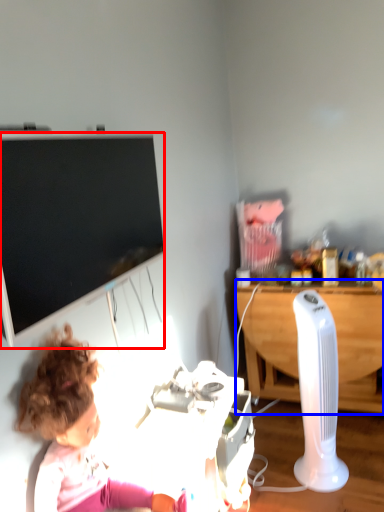
Question: Which object is further to the camera taking this photo, television (highlighted by a red box) or desk (highlighted by a blue box)?

Choices:
 (A) television
 (B) desk

Answer: (B)